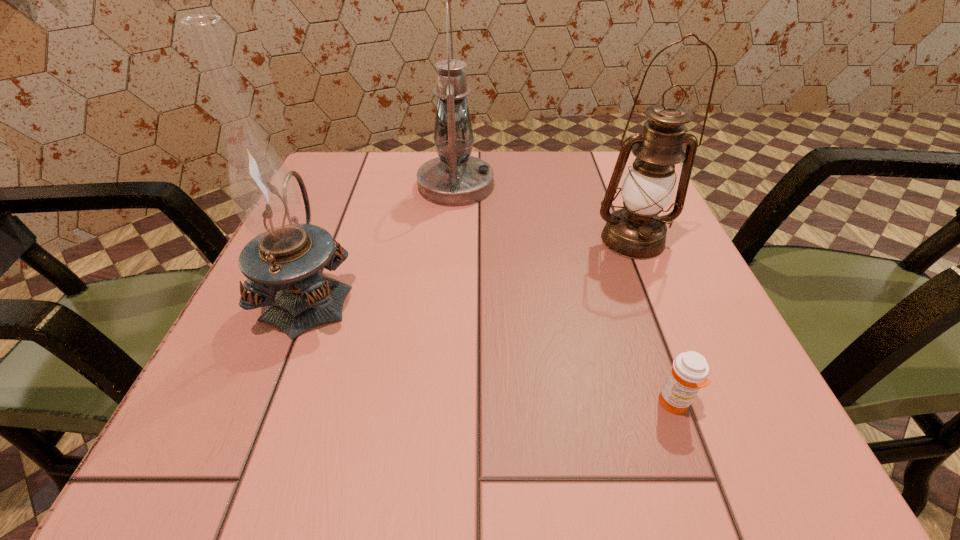
Image resolution: width=960 pixels, height=540 pixels. What are the coordinates of `object that is at the far edge` in the screenshot? It's located at (454, 179).

Find the location of a particular element. object that is positioned at the near edge is located at coordinates (689, 372).

Find the location of a particular element. This screenshot has width=960, height=540. object that is at the left edge is located at coordinates (282, 262).

Find the location of a particular element. oil lamp located in the right edge section of the desktop is located at coordinates (636, 231).

In order to click on medicine at the right edge in this screenshot , I will do `click(689, 372)`.

Locate an element on the screen. This screenshot has height=540, width=960. object that is positioned at the near right corner is located at coordinates (689, 372).

You are a GUI agent. You are given a task and a screenshot of the screen. Output one action in this format:
    pyautogui.click(x=<x>, y=<y>)
    Task: Click on the blank space at the far edge of the desktop
    
    Given the screenshot: What is the action you would take?
    pyautogui.click(x=552, y=185)

Where is `vacant space at the near edge`? vacant space at the near edge is located at coordinates (635, 451).

Image resolution: width=960 pixels, height=540 pixels. What are the coordinates of `free space at the left edge` in the screenshot? It's located at (238, 315).

Locate an element on the screen. vacant space at the right edge is located at coordinates (629, 317).